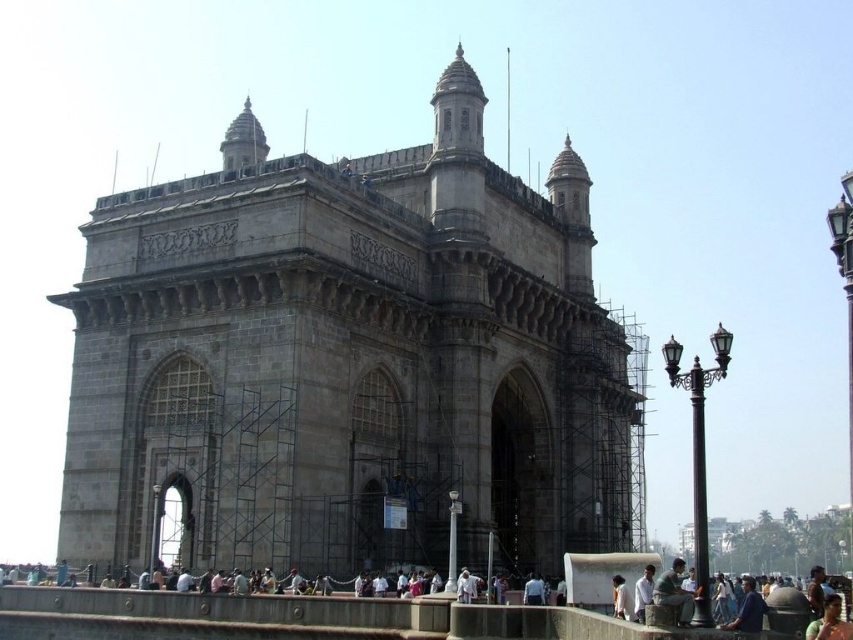
Based on the photo, does light blue shirt at lower right appear under light brown leather jacket at lower center?

Yes.

How far apart are light blue shirt at lower right and light brown leather jacket at lower center?

The distance of light blue shirt at lower right from light brown leather jacket at lower center is 3.21 meters.

Identify the location of light blue shirt at lower right. (674, 593).

The image size is (853, 640). What are the coordinates of `light blue shirt at lower right` in the screenshot? It's located at (674, 593).

Can you confirm if gray stone gateway of india at center is positioned below light brown leather jacket at lower center?

No.

Find the location of `gray stone gateway of india at center`. gray stone gateway of india at center is located at coordinates (347, 360).

Is point (212, 529) less distant than point (670, 582)?

No, (212, 529) is behind (670, 582).

Who is higher up, gray stone gateway of india at center or light blue shirt at lower right?

Positioned higher is gray stone gateway of india at center.

Between point (93, 356) and point (665, 577), which one is positioned behind?

The point (93, 356) is more distant.

Image resolution: width=853 pixels, height=640 pixels. In order to click on gray stone gateway of india at center in this screenshot , I will do `click(347, 360)`.